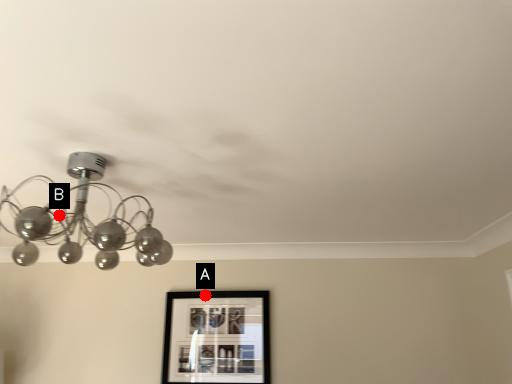
Question: Two points are circled on the image, labeled by A and B beside each circle. Which point appears closest to the camera in this image?

Choices:
 (A) A is closer
 (B) B is closer

Answer: (B)